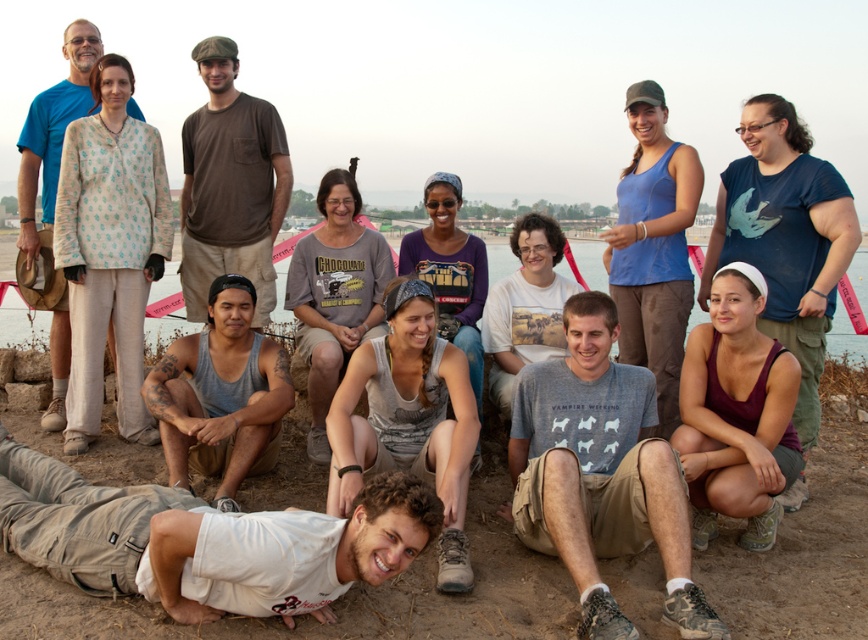
You are standing at the point with coordinates point (71,516) and want to move towards the point with coordinates point (262,502). Which direction should you move in relation to your current position?

You should move towards the point (262,502), which is further to the viewer than your current position at point (71,516). So you need to move forward in the direction towards the viewer.

You are standing at the point marked as point (202, 540) in the image. What object is exactly at this location?

The white cotton shirt at lower center is exactly at point (202, 540).